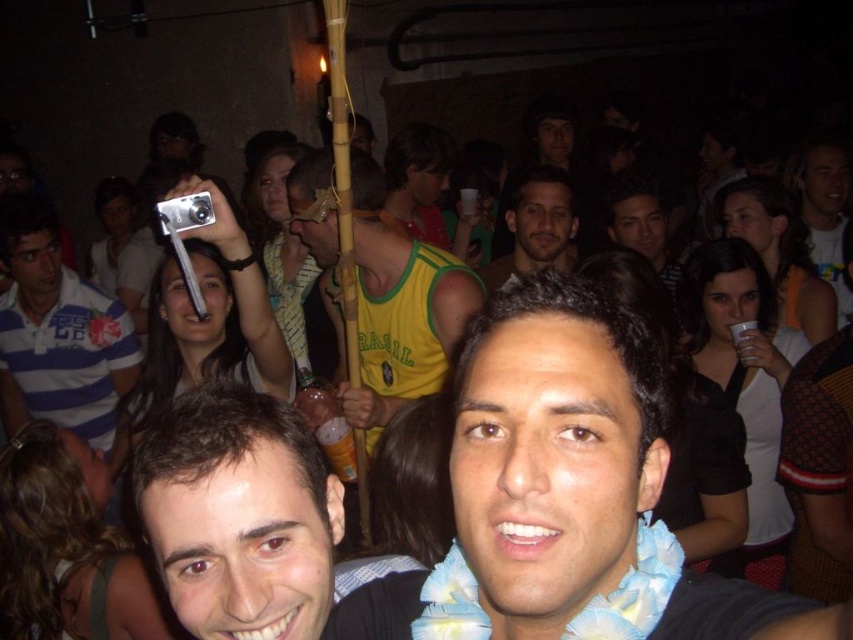
Question: Considering the real-world distances, which object is farthest from the blue floral shirt at center?

Choices:
 (A) smooth brown hair at center
 (B) yellow jersey at center

Answer: (B)

Question: Is blue striped polo shirt at left bigger than matte brown hair at center?

Choices:
 (A) no
 (B) yes

Answer: (B)

Question: Which object is closer to the camera taking this photo?

Choices:
 (A) yellow jersey at center
 (B) smooth brown hair at center
 (C) blue floral shirt at center
 (D) blue striped polo shirt at left

Answer: (C)

Question: Is blue floral shirt at center positioned at the back of yellow jersey at center?

Choices:
 (A) yes
 (B) no

Answer: (B)

Question: Which point appears farthest from the camera in this image?

Choices:
 (A) (16, 211)
 (B) (558, 188)
 (C) (263, 609)

Answer: (A)

Question: Where is smooth brown hair at center located in relation to yellow jersey at center in the image?

Choices:
 (A) below
 (B) above

Answer: (A)